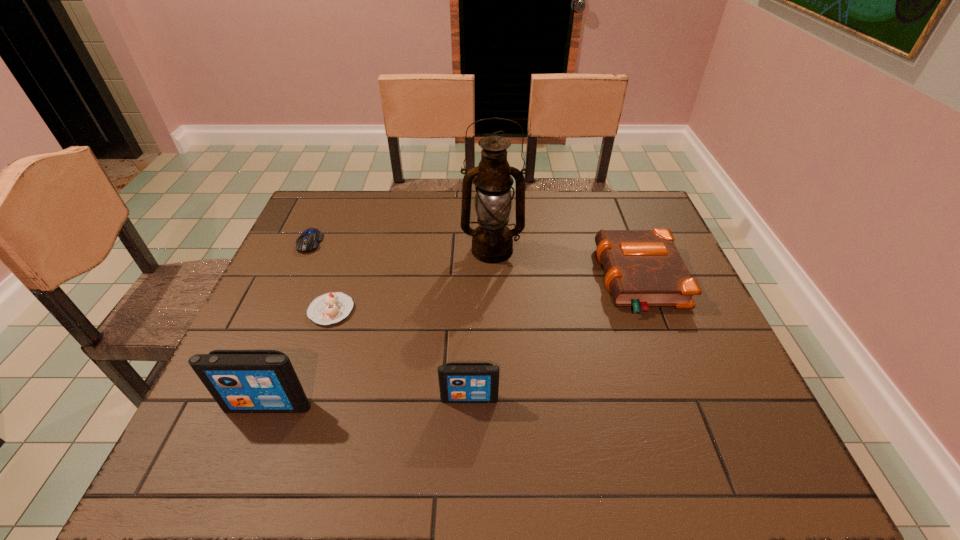
Find the location of a particular element. free spot located on the spine side of the Bible is located at coordinates (474, 280).

What are the coordinates of `free point located 0.050m on the spine side of the Bible` in the screenshot? It's located at (582, 280).

Identify the location of free region located on the spine side of the Bible. (526, 280).

Locate an element on the screen. This screenshot has width=960, height=540. blank space located on the button side of the shortest object is located at coordinates (273, 322).

The width and height of the screenshot is (960, 540). Identify the location of vacant region located 0.150m on the back of the cupcake. (348, 258).

This screenshot has height=540, width=960. What are the coordinates of `object that is positioned at the far edge` in the screenshot? It's located at (308, 241).

You are a GUI agent. You are given a task and a screenshot of the screen. Output one action in this format:
    pyautogui.click(x=<x>, y=<y>)
    Task: Click on the iPod situated at the left edge
    This screenshot has width=960, height=540.
    Given the screenshot: What is the action you would take?
    pyautogui.click(x=241, y=381)

Locate an element on the screen. This screenshot has width=960, height=540. computer mouse that is at the left edge is located at coordinates (308, 241).

At what (x,y) coordinates should I click in order to perform the action: click on cupcake that is at the left edge. Please return your answer as a coordinate pair (x, y). Looking at the image, I should click on [329, 308].

Where is `object that is at the right edge`? The width and height of the screenshot is (960, 540). object that is at the right edge is located at coordinates (643, 268).